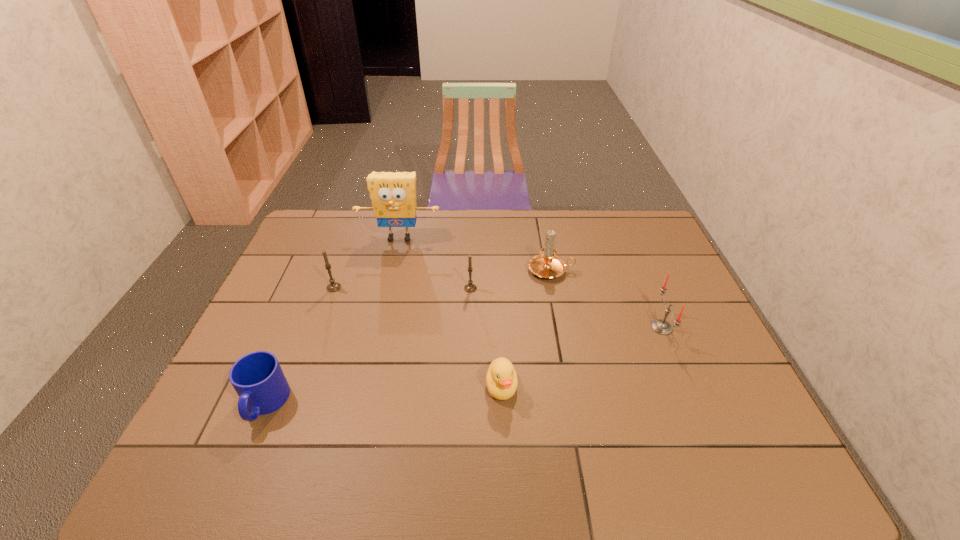
Locate an element on the screen. sponge is located at coordinates (393, 195).

Locate an element on the screen. The width and height of the screenshot is (960, 540). the tallest object is located at coordinates (393, 195).

Image resolution: width=960 pixels, height=540 pixels. In order to click on the third candle from left to right in this screenshot , I will do `click(546, 265)`.

Locate an element on the screen. The width and height of the screenshot is (960, 540). the fifth farthest object is located at coordinates (661, 326).

Where is `the nearest candle`? the nearest candle is located at coordinates (661, 326).

Where is `the leftmost candle`? the leftmost candle is located at coordinates (334, 286).

This screenshot has width=960, height=540. I want to click on the second candle from left to right, so click(x=470, y=287).

The width and height of the screenshot is (960, 540). In order to click on mug in this screenshot , I will do `click(257, 377)`.

You are a GUI agent. You are given a task and a screenshot of the screen. Output one action in this format:
    pyautogui.click(x=<x>, y=<y>)
    Task: Click on the fifth object from left to right
    The height and width of the screenshot is (540, 960).
    Given the screenshot: What is the action you would take?
    pyautogui.click(x=501, y=379)

I want to click on vacant point located 0.080m on the face of the sponge, so click(394, 263).